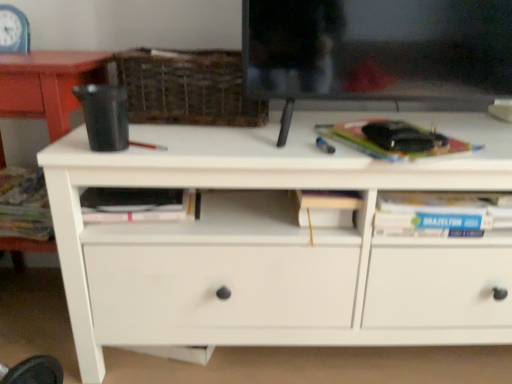
Locate an element on the screen. white matte chest of drawers at center is located at coordinates click(x=276, y=244).

Describe the element at coordinates (276, 244) in the screenshot. I see `white matte chest of drawers at center` at that location.

In order to face hardcover book at right, which is counted as the 1th paperback book, starting from the right, should I rotate leftwards or rightwards?

Rotate your view right by about 17.985°.

How much space does hardcover book at right, the first paperback book in the top-to-bottom sequence, occupy horizontally?

The width of hardcover book at right, the first paperback book in the top-to-bottom sequence, is 28.69 centimeters.

Measure the distance between pink matte paperback book at center, the 2th paperback book in the top-to-bottom sequence, and camera.

pink matte paperback book at center, the 2th paperback book in the top-to-bottom sequence, is 35.04 inches away from camera.

I want to click on blue plastic clock at upper left, so pos(13,30).

Would you consider woven brown basket at upper center to be distant from blue plastic clock at upper left?

No.

Considering the sizes of objects woven brown basket at upper center and blue plastic clock at upper left in the image provided, who is taller, woven brown basket at upper center or blue plastic clock at upper left?

Standing taller between the two is woven brown basket at upper center.

Which is closer to the camera, (x=205, y=102) or (x=2, y=50)?

The point (x=205, y=102) is in front.

From a real-world perspective, which is physically above, woven brown basket at upper center or blue plastic clock at upper left?

In real-world perspective, blue plastic clock at upper left is above.

Can you confirm if hardcover book at left is positioned to the left of blue plastic clock at upper left?

No.

Is hardcover book at left positioned with its back to blue plastic clock at upper left?

No, hardcover book at left's orientation is not away from blue plastic clock at upper left.

In the scene shown: From a real-world perspective, is hardcover book at left physically below blue plastic clock at upper left?

Yes, from a real-world perspective, hardcover book at left is beneath blue plastic clock at upper left.

Considering the points (40, 169) and (8, 11), which point is behind, point (40, 169) or point (8, 11)?

The point (40, 169) is more distant.

From the image's perspective, is blue plastic clock at upper left located above or below pink matte paperback book at center, acting as the second paperback book starting from the right?

Based on their image positions, blue plastic clock at upper left is located above pink matte paperback book at center, acting as the second paperback book starting from the right.

Is blue plastic clock at upper left inside the boundaries of pink matte paperback book at center, acting as the second paperback book starting from the right, or outside?

blue plastic clock at upper left is not inside pink matte paperback book at center, acting as the second paperback book starting from the right, it's outside.

Is point (10, 13) farther from viewer compared to point (126, 192)?

Yes, point (10, 13) is farther from viewer.

Does blue plastic clock at upper left have a lesser width compared to pink matte paperback book at center, the 1th paperback book positioned from the bottom?

Correct, the width of blue plastic clock at upper left is less than that of pink matte paperback book at center, the 1th paperback book positioned from the bottom.

Choose the correct answer: Is hardcover book at left inside pink matte paperback book at center, acting as the second paperback book starting from the right, or outside it?

hardcover book at left is not inside pink matte paperback book at center, acting as the second paperback book starting from the right, it's outside.

Considering the sizes of objects hardcover book at left and pink matte paperback book at center, arranged as the first paperback book when viewed from the left, in the image provided, who is thinner, hardcover book at left or pink matte paperback book at center, arranged as the first paperback book when viewed from the left,?

pink matte paperback book at center, arranged as the first paperback book when viewed from the left, is thinner.

Considering the positions of point (45, 206) and point (114, 215), is point (45, 206) closer or farther from the camera than point (114, 215)?

Clearly, point (45, 206) is more distant from the camera than point (114, 215).

How different are the orientations of hardcover book at left and pink matte paperback book at center, the 2th paperback book in the top-to-bottom sequence, in degrees?

There is a 6.1-degree angle between the facing directions of hardcover book at left and pink matte paperback book at center, the 2th paperback book in the top-to-bottom sequence.

Can you confirm if blue plastic clock at upper left is shorter than woven brown basket at upper center?

Correct, blue plastic clock at upper left is not as tall as woven brown basket at upper center.

This screenshot has width=512, height=384. Identify the location of clock that appears above the woven brown basket at upper center (from the image's perspective). (13, 30).

Is blue plastic clock at upper left not near woven brown basket at upper center?

No, blue plastic clock at upper left is not far from woven brown basket at upper center.

Is blue plastic clock at upper left to the left or to the right of woven brown basket at upper center in the image?

Based on their positions, blue plastic clock at upper left is located to the left of woven brown basket at upper center.

Between hardcover book at right, which is counted as the 1th paperback book, starting from the right, and blue plastic clock at upper left, which one has larger size?

With larger size is hardcover book at right, which is counted as the 1th paperback book, starting from the right.

In the scene shown: Could you measure the distance between hardcover book at right, which appears as the 2th paperback book when ordered from the bottom, and blue plastic clock at upper left?

The distance of hardcover book at right, which appears as the 2th paperback book when ordered from the bottom, from blue plastic clock at upper left is 36.00 inches.

Which paperback book is the 2nd one when counting from the right side of the blue plastic clock at upper left? Please provide its 2D coordinates.

[(393, 139)]

Based on the photo, is hardcover book at right, which is counted as the 1th paperback book, starting from the right, placed right next to blue plastic clock at upper left?

There is a gap between hardcover book at right, which is counted as the 1th paperback book, starting from the right, and blue plastic clock at upper left.

Considering the points (1, 210) and (152, 98), which point is in front, point (1, 210) or point (152, 98)?

The point (152, 98) is closer.

From the picture: Is there a large distance between hardcover book at left and woven brown basket at upper center?

No.

In the scene shown: From the image's perspective, which one is positioned higher, hardcover book at left or woven brown basket at upper center?

From the image's view, woven brown basket at upper center is above.

Looking at this image, in terms of height, does hardcover book at left look taller or shorter compared to woven brown basket at upper center?

In the image, hardcover book at left appears to be shorter than woven brown basket at upper center.

Identify the location of basket that is in front of the blue plastic clock at upper left. (187, 88).

Find the location of a particular element. The width and height of the screenshot is (512, 384). book on the right of blue plastic clock at upper left is located at coordinates (24, 205).

Looking at the image, which one is located further to blue plastic clock at upper left, woven brown basket at upper center or hardcover book at left?

woven brown basket at upper center.

Which object lies further to the anchor point blue plastic clock at upper left, white matte chest of drawers at center or woven brown basket at upper center?

Based on the image, white matte chest of drawers at center appears to be further to blue plastic clock at upper left.

From the picture: Which object lies further to the anchor point hardcover book at right, which appears as the 2th paperback book when ordered from the bottom, blue plastic clock at upper left or hardcover book at left?

blue plastic clock at upper left is further to hardcover book at right, which appears as the 2th paperback book when ordered from the bottom.

Estimate the real-world distances between objects in this image. Which object is further from pink matte paperback book at center, arranged as the first paperback book when viewed from the left, hardcover book at left or hardcover book at right, placed as the 2th paperback book when sorted from left to right?

Based on the image, hardcover book at right, placed as the 2th paperback book when sorted from left to right, appears to be further to pink matte paperback book at center, arranged as the first paperback book when viewed from the left.

Based on their spatial positions, is hardcover book at left or pink matte paperback book at center, arranged as the first paperback book when viewed from the left, closer to white matte chest of drawers at center?

The object closer to white matte chest of drawers at center is pink matte paperback book at center, arranged as the first paperback book when viewed from the left.

When comparing their distances from hardcover book at left, does blue plastic clock at upper left or pink matte paperback book at center, the 1th paperback book positioned from the bottom, seem further?

blue plastic clock at upper left lies further to hardcover book at left than the other object.

When comparing their distances from white matte chest of drawers at center, does woven brown basket at upper center or blue plastic clock at upper left seem closer?

woven brown basket at upper center.

When comparing their distances from woven brown basket at upper center, does white matte chest of drawers at center or pink matte paperback book at center, arranged as the first paperback book when viewed from the left, seem closer?

Based on the image, pink matte paperback book at center, arranged as the first paperback book when viewed from the left, appears to be nearer to woven brown basket at upper center.

The image size is (512, 384). I want to click on chest of drawers between pink matte paperback book at center, the 1th paperback book positioned from the bottom, and hardcover book at right, which is counted as the 1th paperback book, starting from the right, in the horizontal direction, so click(276, 244).

Where is `chest of drawers between woven brown basket at upper center and hardcover book at right, placed as the 2th paperback book when sorted from left to right`? The height and width of the screenshot is (384, 512). chest of drawers between woven brown basket at upper center and hardcover book at right, placed as the 2th paperback book when sorted from left to right is located at coordinates (276, 244).

Find the location of a particular element. This screenshot has width=512, height=384. paperback book located between hardcover book at left and white matte chest of drawers at center in the left-right direction is located at coordinates (135, 204).

At what (x,y) coordinates should I click in order to perform the action: click on basket between hardcover book at left and hardcover book at right, which is counted as the 1th paperback book, starting from the right, from left to right. Please return your answer as a coordinate pair (x, y). Image resolution: width=512 pixels, height=384 pixels. Looking at the image, I should click on (187, 88).